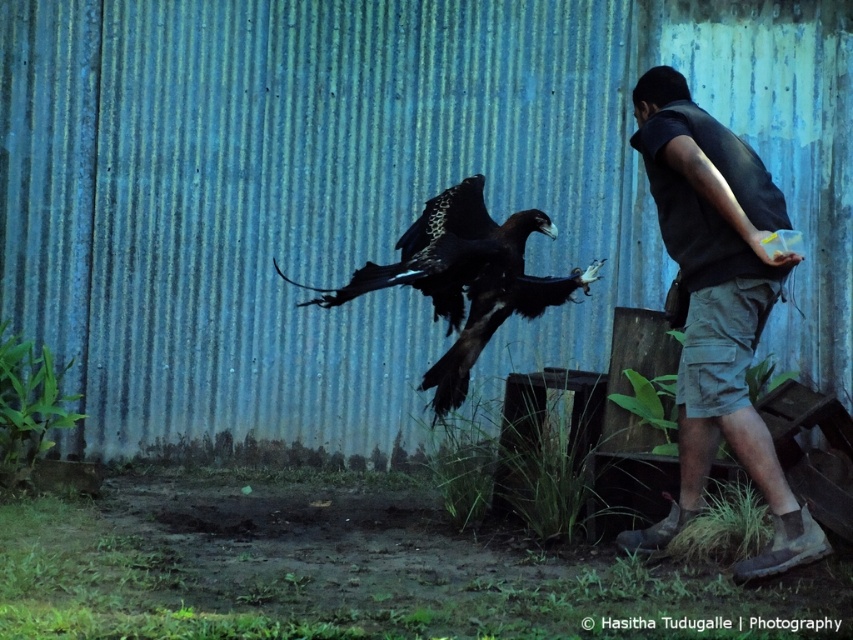
Does dark gray vest at right appear on the right side of dark brown feathers at center?

Yes, dark gray vest at right is to the right of dark brown feathers at center.

Identify the location of dark gray vest at right. The height and width of the screenshot is (640, 853). (717, 308).

Is point (689, 216) closer to camera compared to point (532, 307)?

Yes, it is.

Where is `dark gray vest at right`? This screenshot has height=640, width=853. dark gray vest at right is located at coordinates (717, 308).